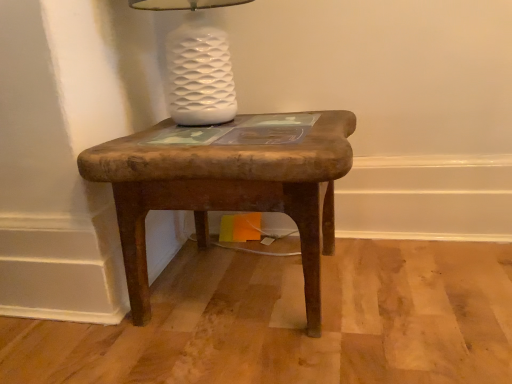
Where is `vacant space underneath white glossy lamp at upper center (from a real-world perspective)`? The width and height of the screenshot is (512, 384). vacant space underneath white glossy lamp at upper center (from a real-world perspective) is located at coordinates (207, 126).